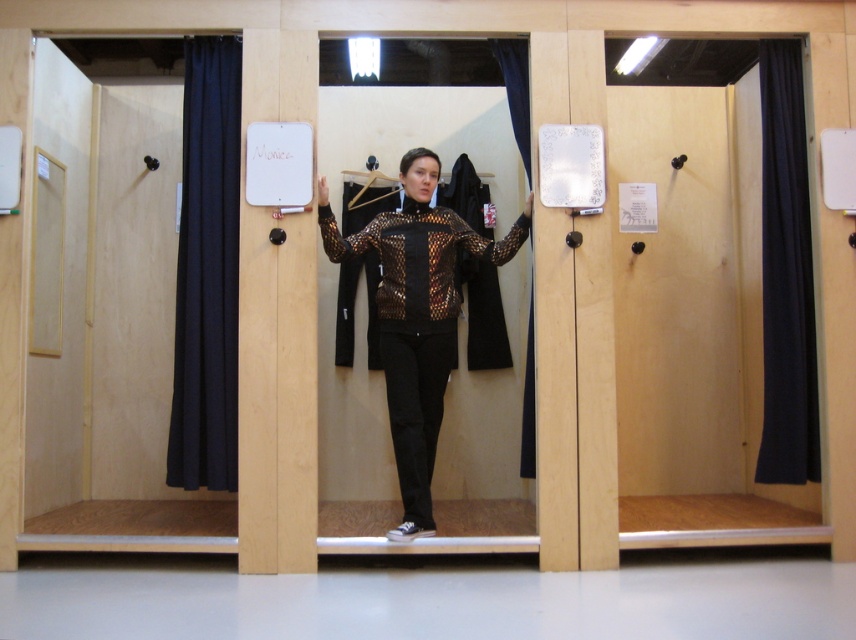
Question: Which object appears closest to the camera in this image?

Choices:
 (A) black fabric curtain at left
 (B) leopard print jacket at center
 (C) metallic silver hanger at center

Answer: (B)

Question: Is the position of dark blue fabric curtain at right more distant than that of metallic silver hanger at center?

Choices:
 (A) yes
 (B) no

Answer: (B)

Question: Among these objects, which one is farthest from the camera?

Choices:
 (A) black fabric curtain at center
 (B) black fabric curtain at left
 (C) leopard print jacket at center
 (D) dark blue fabric curtain at right

Answer: (D)

Question: Considering the real-world distances, which object is closest to the black fabric curtain at left?

Choices:
 (A) dark blue fabric curtain at right
 (B) leopard print jacket at center
 (C) black fabric curtain at center

Answer: (B)

Question: Is leopard print jacket at center to the left of metallic silver hanger at center from the viewer's perspective?

Choices:
 (A) no
 (B) yes

Answer: (A)

Question: Observing the image, what is the correct spatial positioning of leopard print jacket at center in reference to dark blue fabric curtain at right?

Choices:
 (A) left
 (B) right

Answer: (A)